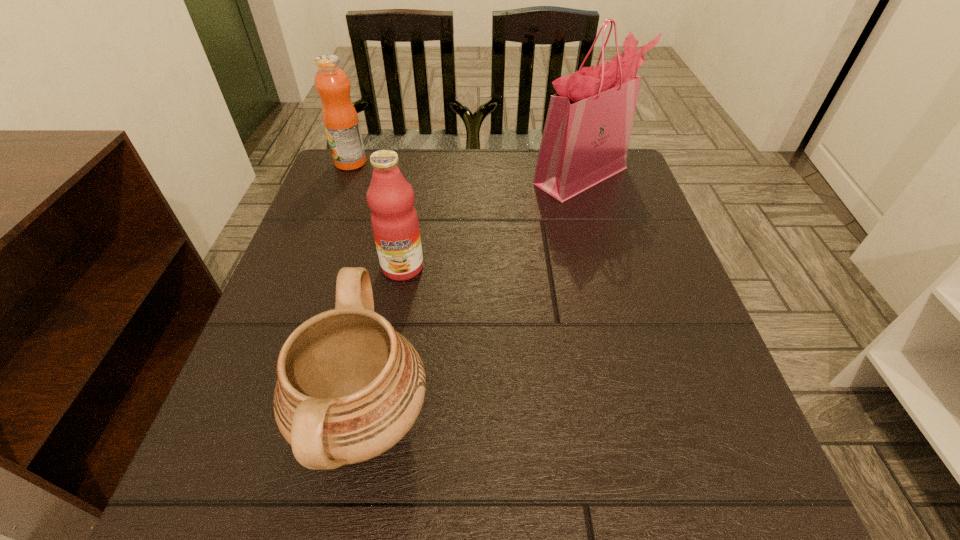
Find the location of a particular element. vacant space situated 0.300m on the label of the third farthest object is located at coordinates (375, 425).

Locate an element on the screen. This screenshot has height=540, width=960. free space located 0.060m on the front-facing side of the shortest object is located at coordinates (470, 421).

The image size is (960, 540). Find the location of `shopping bag situated at the far edge`. shopping bag situated at the far edge is located at coordinates (586, 136).

Locate an element on the screen. This screenshot has height=540, width=960. fruit juice present at the far edge is located at coordinates (332, 84).

Identify the location of object at the near edge. The height and width of the screenshot is (540, 960). (349, 387).

In order to click on fruit juice that is at the left edge in this screenshot , I will do `click(332, 84)`.

I want to click on urn that is at the left edge, so (349, 387).

The image size is (960, 540). Identify the location of object present at the right edge. (586, 136).

The height and width of the screenshot is (540, 960). Identify the location of object situated at the far left corner. (332, 84).

I want to click on object at the near left corner, so click(349, 387).